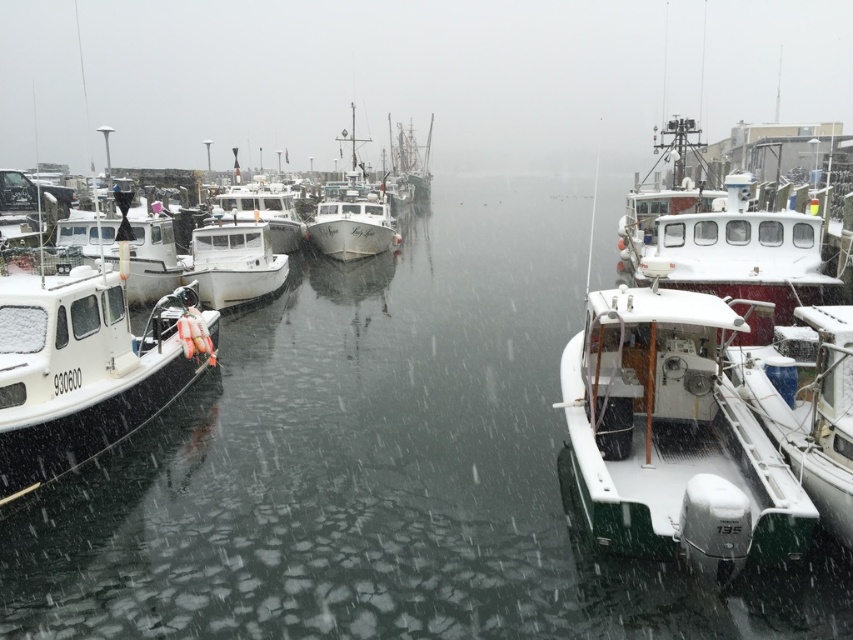
Based on the photo, which is more to the right, white matte boat at right or white glossy boat at center?

white matte boat at right

Is white matte boat at right closer to the viewer compared to white glossy boat at center?

Yes, it is in front of white glossy boat at center.

Is point (848, 468) farther from viewer compared to point (357, 168)?

No, it is in front of (357, 168).

Locate an element on the screen. white matte boat at right is located at coordinates (805, 404).

Which of these two, white matte boat at left or shiny silver ship at center, stands shorter?

white matte boat at left is shorter.

Describe the element at coordinates (86, 368) in the screenshot. I see `white matte boat at left` at that location.

Image resolution: width=853 pixels, height=640 pixels. What do you see at coordinates (86, 368) in the screenshot? I see `white matte boat at left` at bounding box center [86, 368].

Find the location of a particular element. white matte boat at left is located at coordinates (86, 368).

Can you confirm if clear water at center is bigger than white matte boat at right?

Correct, clear water at center is larger in size than white matte boat at right.

Between point (358, 282) and point (805, 381), which one is positioned behind?

Point (358, 282)

Who is more distant from viewer, (572, 545) or (821, 417)?

The point (572, 545) is more distant.

This screenshot has width=853, height=640. I want to click on clear water at center, so click(378, 468).